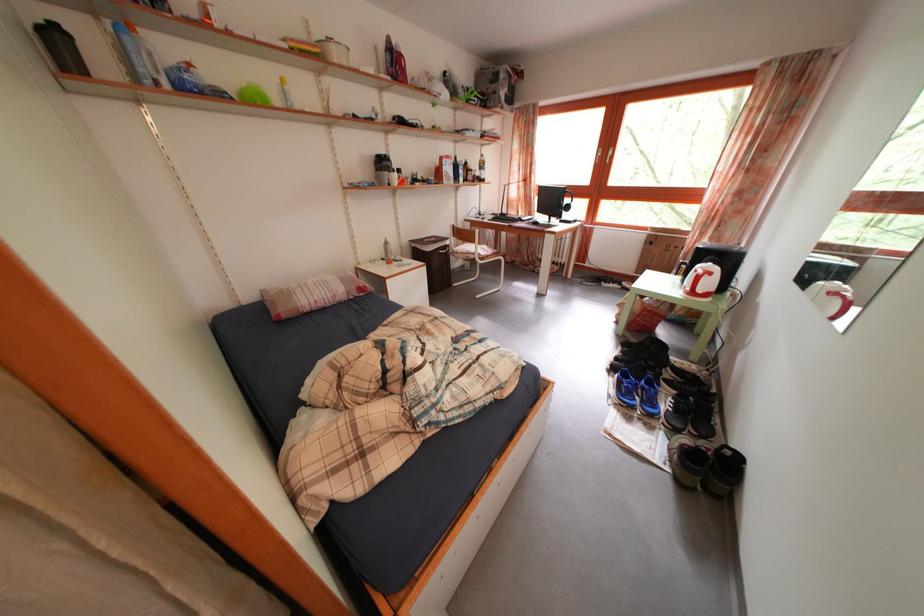
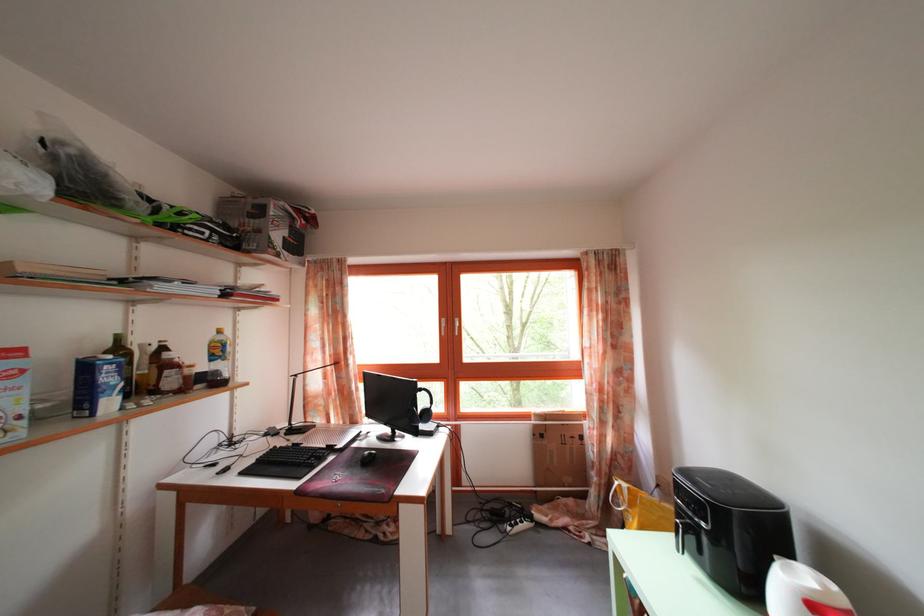
The point at (468, 187) is marked in the first image. Where is the corresponding point in the second image?

(117, 410)